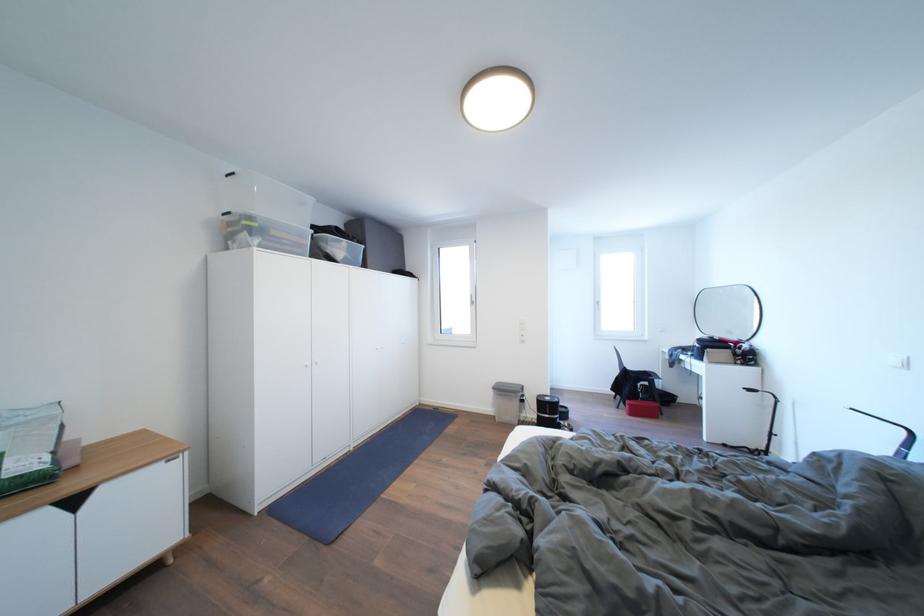
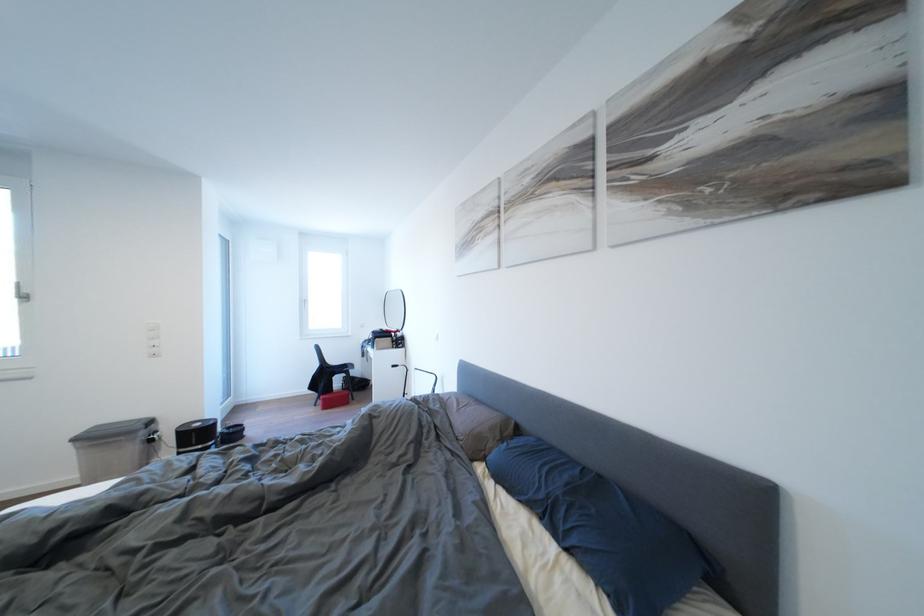
Question: How did the camera likely rotate?

Choices:
 (A) Left
 (B) Right
 (C) Up
 (D) Down

Answer: (B)